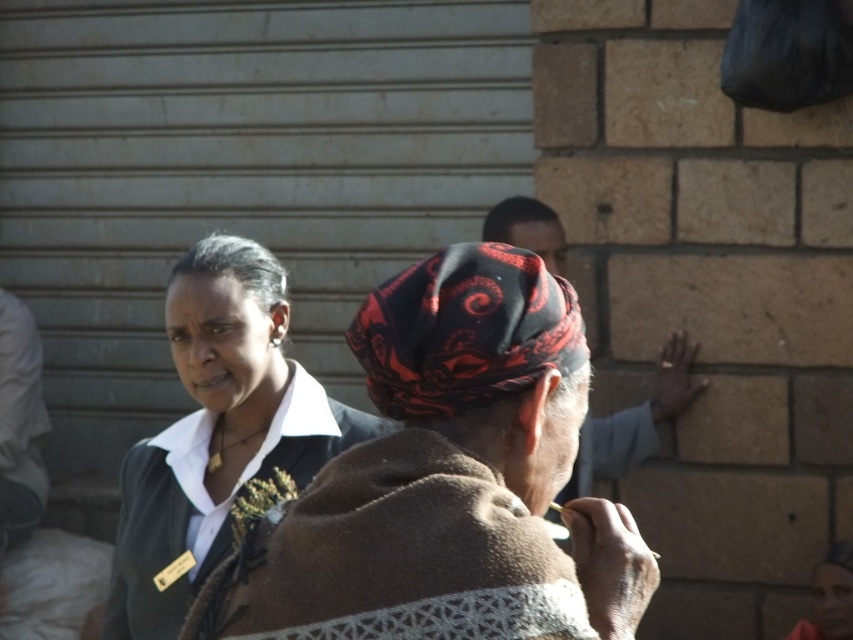
Does black woven headscarf at center have a lesser height compared to red-patterned headscarf at center?

Yes, black woven headscarf at center is shorter than red-patterned headscarf at center.

What do you see at coordinates (465, 332) in the screenshot? I see `black woven headscarf at center` at bounding box center [465, 332].

Between point (517, 349) and point (677, 376), which one is positioned in front?

Positioned in front is point (517, 349).

Image resolution: width=853 pixels, height=640 pixels. What are the coordinates of `black woven headscarf at center` in the screenshot? It's located at (465, 332).

Is black matte jacket at center behind black woven headscarf at center?

Yes, it is behind black woven headscarf at center.

Between point (181, 550) and point (368, 340), which one is positioned behind?

The point (181, 550) is more distant.

Image resolution: width=853 pixels, height=640 pixels. What do you see at coordinates (218, 435) in the screenshot? I see `black matte jacket at center` at bounding box center [218, 435].

Locate an element on the screen. Image resolution: width=853 pixels, height=640 pixels. black matte jacket at center is located at coordinates (218, 435).

Which is more to the right, brown woolen shawl at center or red-patterned headscarf at center?

From the viewer's perspective, red-patterned headscarf at center appears more on the right side.

Is point (598, 547) closer to camera compared to point (492, 227)?

Yes, it is in front of point (492, 227).

Which is in front, point (425, 440) or point (666, 404)?

Point (425, 440) is more forward.

Identify the location of brown woolen shawl at center. The width and height of the screenshot is (853, 640). (447, 481).